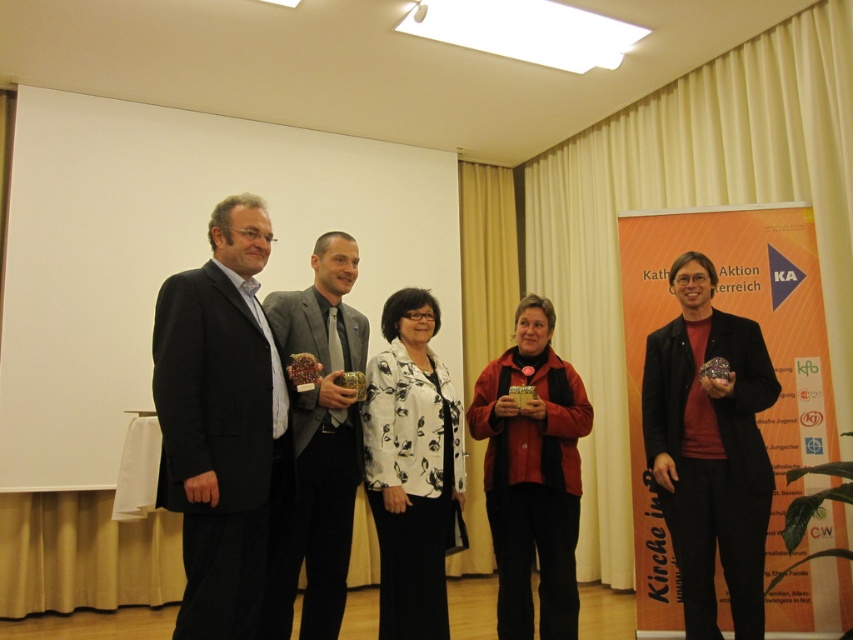
Which is above, matte gray suit at center or white floral fabric at center?

matte gray suit at center

Is matte gray suit at center positioned behind white floral fabric at center?

That is False.

Where is `matte gray suit at center`? matte gray suit at center is located at coordinates (318, 444).

Can you confirm if matte red jacket at center is smaller than matte gray suit at center?

Yes, matte red jacket at center is smaller than matte gray suit at center.

Can you confirm if matte red jacket at center is wider than matte gray suit at center?

Yes, matte red jacket at center is wider than matte gray suit at center.

The width and height of the screenshot is (853, 640). I want to click on matte red jacket at center, so click(x=532, y=474).

Based on the photo, who is shorter, black matte suit at left or matte black dress at center?

Standing shorter between the two is black matte suit at left.

Who is positioned more to the left, black matte suit at left or matte black dress at center?

Positioned to the left is black matte suit at left.

Which is in front, point (245, 232) or point (680, 296)?

Point (245, 232)

Where is `black matte suit at left`? The width and height of the screenshot is (853, 640). black matte suit at left is located at coordinates (221, 422).